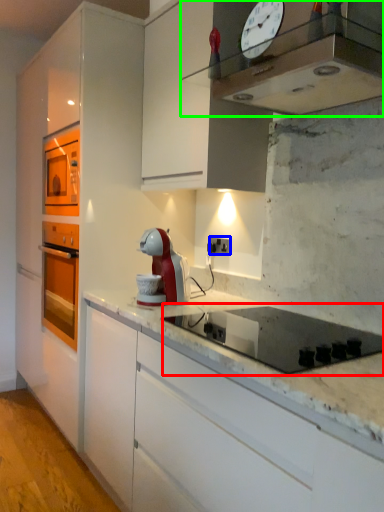
Question: Considering the real-world distances, which object is farthest from gas stove (highlighted by a red box)? electric outlet (highlighted by a blue box) or home appliance (highlighted by a green box)?

Choices:
 (A) electric outlet
 (B) home appliance

Answer: (A)